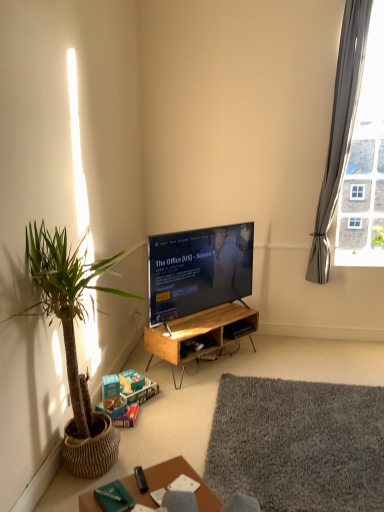
Locate an element on the screen. Image resolution: width=384 pixels, height=512 pixels. vacant area situated below green woven pot at left (from a real-world perspective) is located at coordinates (100, 475).